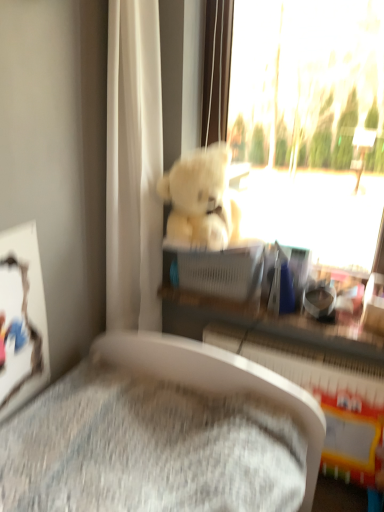
This screenshot has height=512, width=384. Identify the location of white plush bear at upper center. (306, 108).

At what (x,y) coordinates should I click in order to perform the action: click on white plush bear at upper center. Please return your answer as a coordinate pair (x, y). The width and height of the screenshot is (384, 512). Looking at the image, I should click on (306, 108).

From the picture: From a real-world perspective, between fluffy white teddy bear at upper center and white fabric curtain at upper center, who is vertically lower?

white fabric curtain at upper center, from a real-world perspective.

Which object is thinner, fluffy white teddy bear at upper center or white fabric curtain at upper center?

white fabric curtain at upper center is thinner.

I want to click on curtain below the fluffy white teddy bear at upper center (from a real-world perspective), so click(x=134, y=166).

Measure the distance from fluffy white teddy bear at upper center to white fabric curtain at upper center.

fluffy white teddy bear at upper center is 21.86 centimeters from white fabric curtain at upper center.

From the image's perspective, which is below, matte plastic shelf at center or white plastic radiator at lower center?

white plastic radiator at lower center is shown below in the image.

Between matte plastic shelf at center and white plastic radiator at lower center, which one has larger size?

Bigger between the two is white plastic radiator at lower center.

Is white plastic radiator at lower center surrounded by matte plastic shelf at center?

That's incorrect, white plastic radiator at lower center is not inside matte plastic shelf at center.

Considering the relative sizes of matte plastic shelf at center and white plastic radiator at lower center in the image provided, is matte plastic shelf at center thinner than white plastic radiator at lower center?

Yes.

Considering the sizes of matte plastic shelf at center and white fabric curtain at upper center in the image, is matte plastic shelf at center bigger or smaller than white fabric curtain at upper center?

In the image, matte plastic shelf at center appears to be smaller than white fabric curtain at upper center.

Is matte plastic shelf at center further to camera compared to white fabric curtain at upper center?

That is True.

From the picture: Can you tell me how much matte plastic shelf at center and white fabric curtain at upper center differ in facing direction?

The angular difference between matte plastic shelf at center and white fabric curtain at upper center is 1.22 degrees.

Does point (320, 323) come behind point (148, 202)?

No.

Considering the positions of points (195, 216) and (325, 388), is point (195, 216) closer to camera compared to point (325, 388)?

No, (195, 216) is behind (325, 388).

Can you confirm if fluffy white teddy bear at upper center is shorter than white plastic radiator at lower center?

Yes, fluffy white teddy bear at upper center is shorter than white plastic radiator at lower center.

Can you tell me how much fluffy white teddy bear at upper center and white plastic radiator at lower center differ in facing direction?

They differ by 4.38 degrees in their facing directions.

From a real-world perspective, which object rests below the other?

In real-world perspective, white plastic radiator at lower center is lower.

From the image's perspective, relative to white plush bear at upper center, is matte plastic shelf at center above or below?

From the image's perspective, matte plastic shelf at center appears below white plush bear at upper center.

Does point (353, 321) lie in front of point (238, 54)?

Yes, point (353, 321) is closer to viewer.

Is matte plastic shelf at center facing away from white plush bear at upper center?

No.

Which object is thinner, matte plastic shelf at center or white plush bear at upper center?

matte plastic shelf at center is thinner.

Does white plastic radiator at lower center have a smaller size compared to fluffy white teddy bear at upper center?

No.

From the image's perspective, between white plastic radiator at lower center and fluffy white teddy bear at upper center, which one is located above?

fluffy white teddy bear at upper center is shown above in the image.

Is white plastic radiator at lower center positioned in front of fluffy white teddy bear at upper center?

Yes, the depth of white plastic radiator at lower center is less than that of fluffy white teddy bear at upper center.

Is white plush bear at upper center positioned behind fluffy white teddy bear at upper center?

No, it is in front of fluffy white teddy bear at upper center.

From a real-world perspective, is white plush bear at upper center physically located above or below fluffy white teddy bear at upper center?

In terms of real-world spatial position, white plush bear at upper center is above fluffy white teddy bear at upper center.

Locate an element on the screen. The width and height of the screenshot is (384, 512). teddy bear below the white plush bear at upper center (from the image's perspective) is located at coordinates (201, 199).

Is white plush bear at upper center oriented towards fluffy white teddy bear at upper center?

Yes, white plush bear at upper center is turned towards fluffy white teddy bear at upper center.

The height and width of the screenshot is (512, 384). Identify the location of curtain located on the left of fluffy white teddy bear at upper center. (134, 166).

Identify the location of radiator below the matte plastic shelf at center (from the image's perspective). click(x=324, y=397).

Considering their positions, is matte plastic shelf at center positioned further to white plastic radiator at lower center than fluffy white teddy bear at upper center?

Among the two, fluffy white teddy bear at upper center is located further to white plastic radiator at lower center.

Which object lies further to the anchor point white fabric curtain at upper center, white plush bear at upper center or white plastic radiator at lower center?

white plastic radiator at lower center.

When comparing their distances from white plastic radiator at lower center, does matte plastic shelf at center or white fabric curtain at upper center seem further?

Based on the image, white fabric curtain at upper center appears to be further to white plastic radiator at lower center.

Looking at the image, which one is located closer to white fabric curtain at upper center, white plastic radiator at lower center or fluffy white teddy bear at upper center?

fluffy white teddy bear at upper center lies closer to white fabric curtain at upper center than the other object.

Based on the photo, considering their positions, is matte plastic shelf at center positioned further to fluffy white teddy bear at upper center than white plastic radiator at lower center?

Based on the image, white plastic radiator at lower center appears to be further to fluffy white teddy bear at upper center.

Estimate the real-world distances between objects in this image. Which object is further from fluffy white teddy bear at upper center, matte plastic shelf at center or white fabric curtain at upper center?

matte plastic shelf at center is further to fluffy white teddy bear at upper center.

Considering their positions, is white fabric curtain at upper center positioned further to matte plastic shelf at center than white plastic radiator at lower center?

The object further to matte plastic shelf at center is white fabric curtain at upper center.

When comparing their distances from white plastic radiator at lower center, does fluffy white teddy bear at upper center or white fabric curtain at upper center seem closer?

Among the two, fluffy white teddy bear at upper center is located nearer to white plastic radiator at lower center.

You are a GUI agent. You are given a task and a screenshot of the screen. Output one action in this format:
    pyautogui.click(x=<x>, y=<y>)
    Task: Click on the curtain between fluffy white teddy bear at upper center and white plastic radiator at lower center vertically
    
    Given the screenshot: What is the action you would take?
    pyautogui.click(x=134, y=166)

The width and height of the screenshot is (384, 512). Find the location of `shelf between white fabric curtain at upper center and white plastic radiator at lower center from top to bottom`. shelf between white fabric curtain at upper center and white plastic radiator at lower center from top to bottom is located at coordinates (264, 323).

At what (x,y) coordinates should I click in order to perform the action: click on teddy bear between white plush bear at upper center and matte plastic shelf at center in the up-down direction. Please return your answer as a coordinate pair (x, y). Looking at the image, I should click on (201, 199).

Locate an element on the screen. The height and width of the screenshot is (512, 384). shelf situated between white fabric curtain at upper center and white plush bear at upper center from left to right is located at coordinates (264, 323).